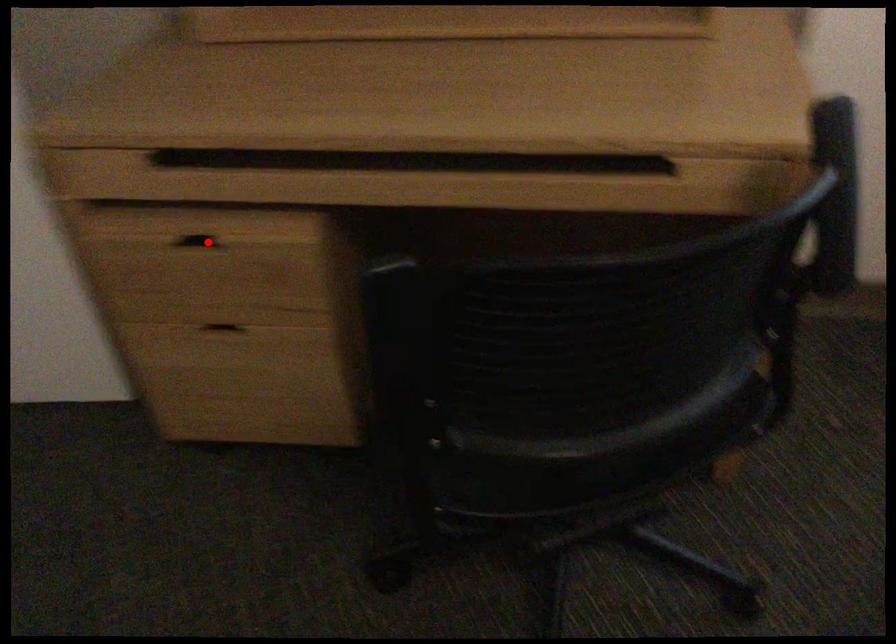
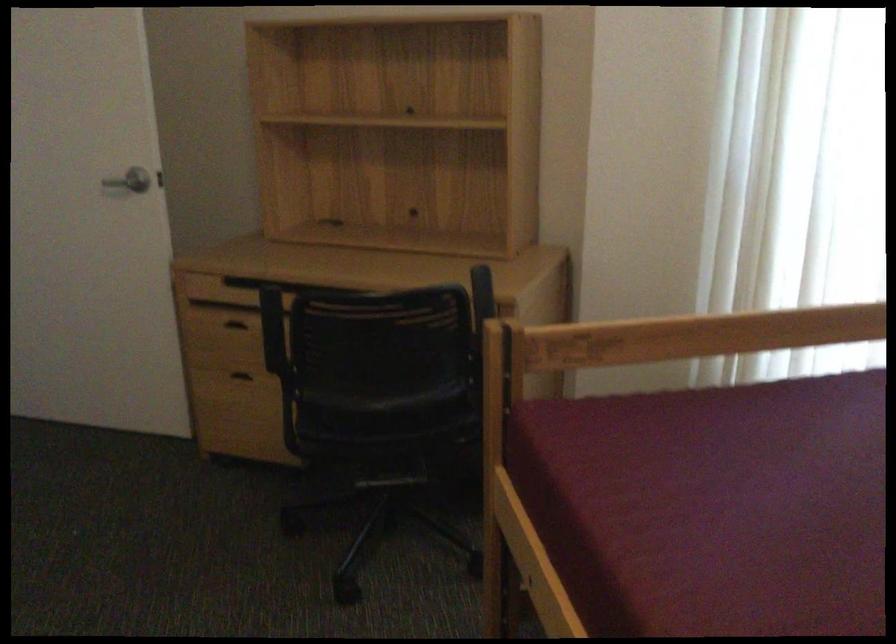
Question: I am providing you with two images of the same scene from different viewpoints. Given a red point in image1, look at the same physical point in image2. Is it:

Choices:
 (A) Closer to the viewpoint
 (B) Farther from the viewpoint

Answer: (B)